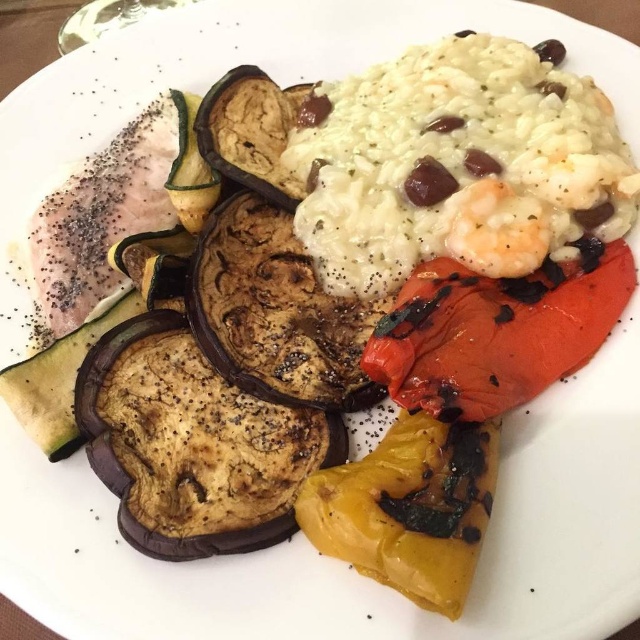
You are a food critic who needs to reach for the charred red pepper at right and the yellow charred pepper at lower center. If your hand can only extend 5 inches, will you be able to reach both peppers without moving your arm?

The distance between the charred red pepper at right and the yellow charred pepper at lower center is 5.75 inches. Since your hand can only extend 5 inches, you won t be able to reach both peppers without moving your arm.

You are a food critic analyzing the arrangement of the charred red pepper at right and the yellow charred pepper at lower center on the plate. Which pepper is positioned higher on the plate?

The charred red pepper at right is taller than the yellow charred pepper at lower center, so it is positioned higher on the plate.

You are a food critic standing 5 feet away from the plate. You want to taste the white creamy rice at upper right. Can you reach it without moving closer? Please explain your reasoning.

The white creamy rice at upper right is 4.30 feet from the viewer. Since you are standing 5 feet away, it is slightly out of reach. You would need to move about 0.70 feet closer to access it.